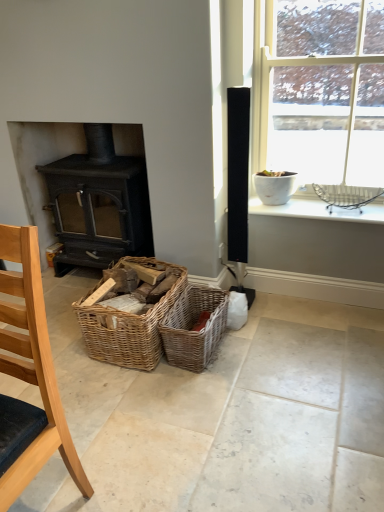
I want to click on free spot in front of woven brown picnic basket at center, the first picnic basket from the right, so click(200, 391).